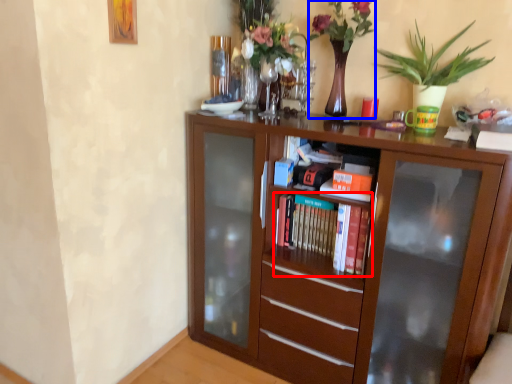
Question: Which point is closer to the camera, book (highlighted by a red box) or floral arrangement (highlighted by a blue box)?

Choices:
 (A) book
 (B) floral arrangement

Answer: (B)